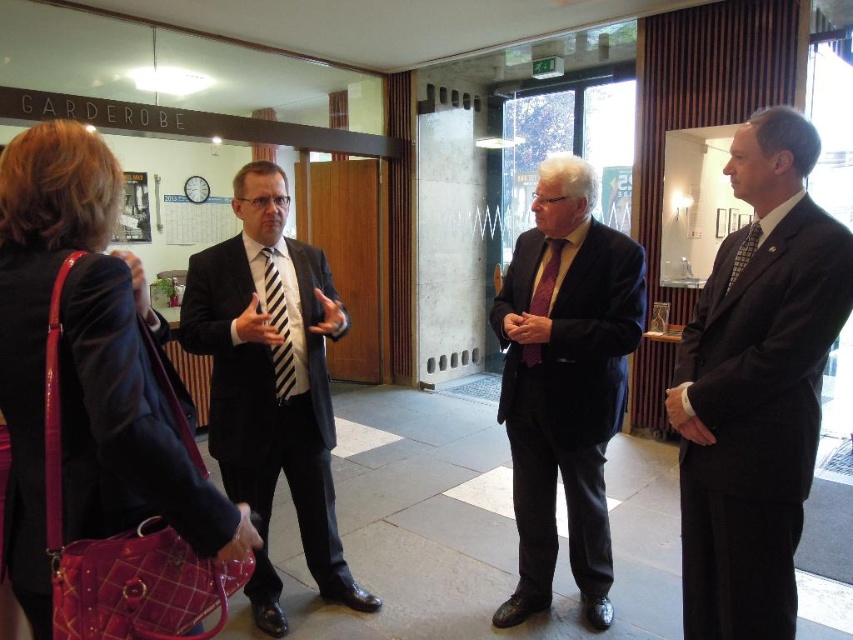
Question: In this image, where is dark suit at center located relative to black striped tie at center?

Choices:
 (A) below
 (B) above

Answer: (A)

Question: Which of these objects is positioned farthest from the purple silk tie at center?

Choices:
 (A) plaid fabric handbag at center-left
 (B) checkered fabric tie at right
 (C) black striped tie at center
 (D) dark suit at center

Answer: (A)

Question: Is the position of plaid fabric handbag at center-left less distant than that of purple silk tie at center?

Choices:
 (A) yes
 (B) no

Answer: (A)

Question: Is plaid fabric handbag at center-left positioned in front of velvet purple tie at center?

Choices:
 (A) no
 (B) yes

Answer: (B)

Question: Among these points, which one is nearest to the camera?

Choices:
 (A) (526, 342)
 (B) (276, 605)

Answer: (A)

Question: Estimate the real-world distances between objects in this image. Which object is farther from the purple silk tie at center?

Choices:
 (A) matte black suit at center
 (B) plaid fabric handbag at center-left

Answer: (B)